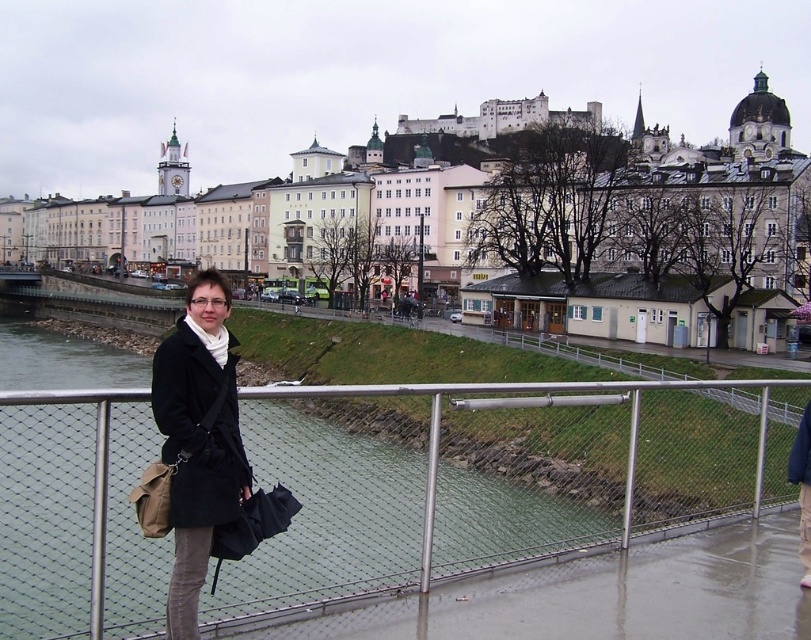
Is metal mesh fence at lower center bigger than black matte coat at center?

No, metal mesh fence at lower center is not bigger than black matte coat at center.

I want to click on metal mesh fence at lower center, so click(x=491, y=477).

This screenshot has height=640, width=811. Find the location of `metal mesh fence at lower center`. metal mesh fence at lower center is located at coordinates click(491, 477).